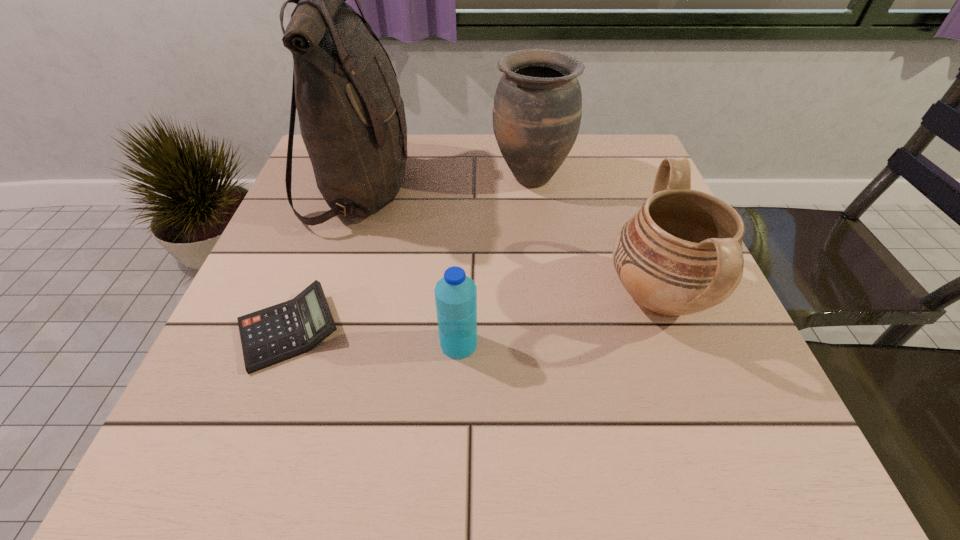
Locate an element on the screen. the tallest object is located at coordinates (352, 119).

Identify the location of the farther urn. The width and height of the screenshot is (960, 540). (537, 110).

You are a GUI agent. You are given a task and a screenshot of the screen. Output one action in this format:
    pyautogui.click(x=<x>, y=<y>)
    Task: Click on the taller urn
    The image size is (960, 540).
    Given the screenshot: What is the action you would take?
    pyautogui.click(x=537, y=110)

Where is `the nearer urn`? the nearer urn is located at coordinates (681, 253).

The image size is (960, 540). In order to click on the third tallest object in this screenshot , I will do `click(681, 253)`.

Identify the location of the second shortest object. Image resolution: width=960 pixels, height=540 pixels. (455, 294).

Where is `the third object from right to left`? the third object from right to left is located at coordinates (455, 294).

Find the location of a particular element. calculator is located at coordinates (283, 331).

Where is `vacant space located 0.060m on the open flap of the backpack`? vacant space located 0.060m on the open flap of the backpack is located at coordinates tap(438, 190).

This screenshot has height=540, width=960. Find the location of `vacant space situated on the front of the farther urn`. vacant space situated on the front of the farther urn is located at coordinates (537, 220).